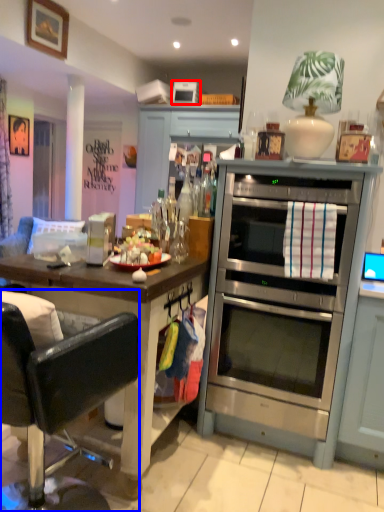
Question: Among these objects, which one is farthest to the camera, appliance (highlighted by a red box) or chair (highlighted by a blue box)?

Choices:
 (A) appliance
 (B) chair

Answer: (A)